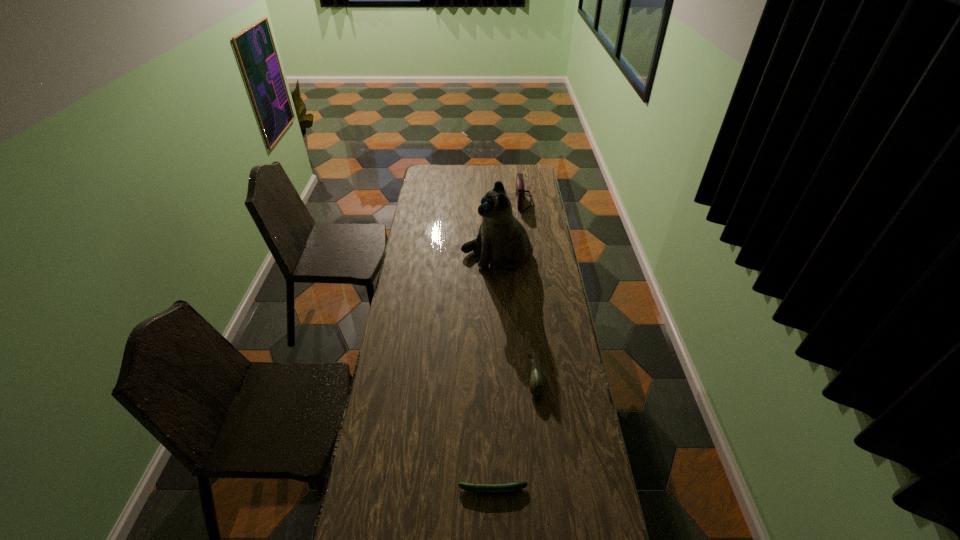
The image size is (960, 540). What are the coordinates of `empty space that is in between the left zucchini and the third shortest object` in the screenshot? It's located at (508, 346).

Locate an element on the screen. This screenshot has width=960, height=540. free spot between the shoulder bag and the farther zucchini is located at coordinates (529, 289).

Choose which object is the second nearest neighbor to the left zucchini. Please provide its 2D coordinates. Your answer should be formatted as a tuple, i.e. [(x, y)], where the tuple contains the x and y coordinates of a point satisfying the conditions above.

[(502, 239)]

Image resolution: width=960 pixels, height=540 pixels. What are the coordinates of `object identified as the closest to the third shortest object` in the screenshot? It's located at (502, 239).